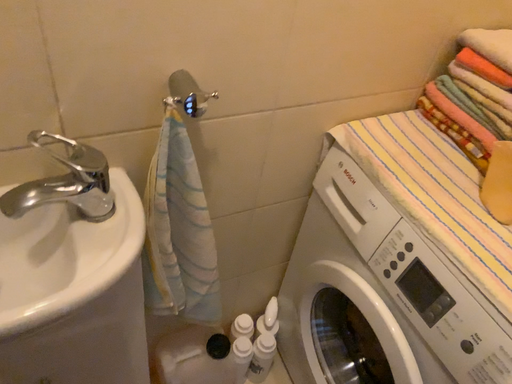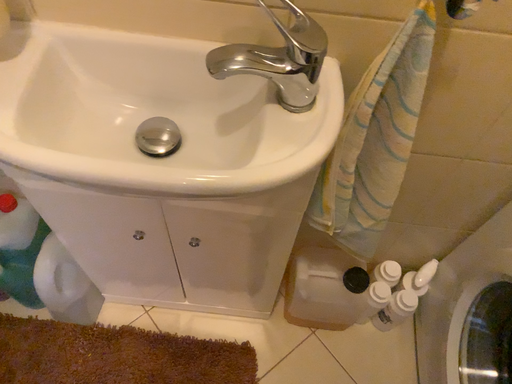
Question: Which way did the camera rotate in the video?

Choices:
 (A) rotated downward
 (B) rotated upward

Answer: (A)